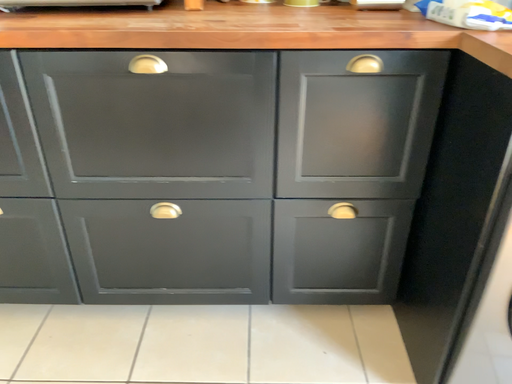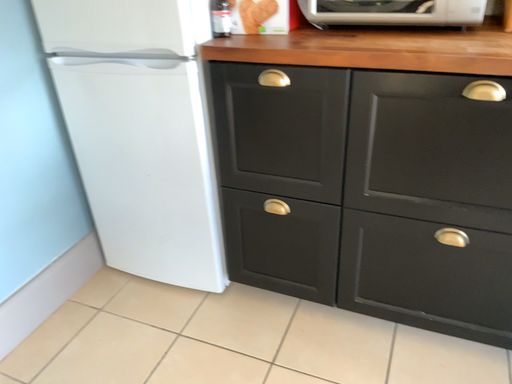
Question: Which way did the camera rotate in the video?

Choices:
 (A) rotated right
 (B) rotated left

Answer: (B)